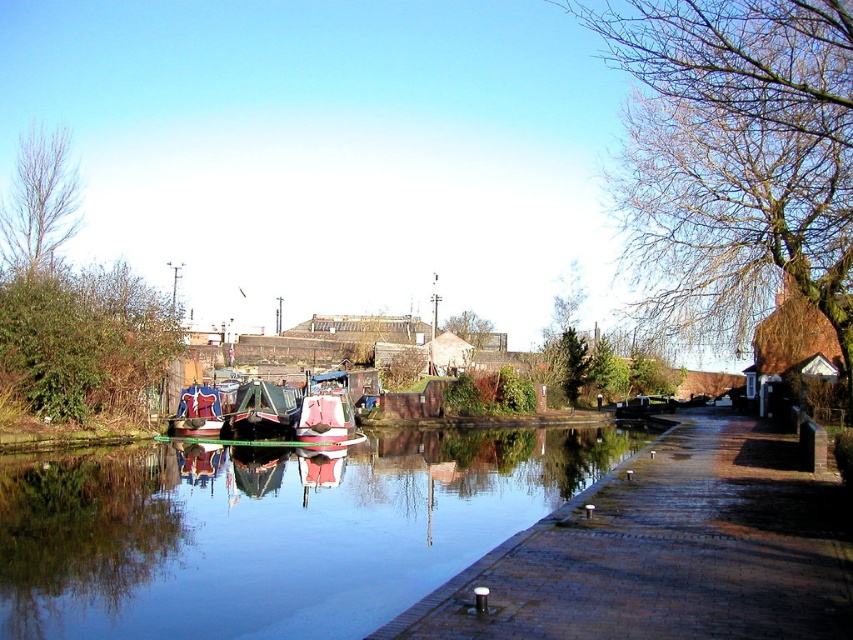
Question: Is bare branches at upper right in front of polished wood boat at center?

Choices:
 (A) yes
 (B) no

Answer: (A)

Question: Is green leafy tree at left further to the viewer compared to bare branches at upper left?

Choices:
 (A) yes
 (B) no

Answer: (B)

Question: Which point is closer to the camera?

Choices:
 (A) (408, 468)
 (B) (310, 412)

Answer: (A)

Question: From the image, what is the correct spatial relationship of bare branches at upper left in relation to wooden polished boat at center?

Choices:
 (A) above
 (B) below

Answer: (A)

Question: Considering the real-world distances, which object is closest to the bare branches at upper right?

Choices:
 (A) brick paved path at center
 (B) smooth reflective water at center
 (C) green leafy tree at left
 (D) wooden polished boat at center

Answer: (A)

Question: Which object appears closest to the camera in this image?

Choices:
 (A) brick paved path at center
 (B) wooden polished boat at center
 (C) green leafy tree at left

Answer: (A)